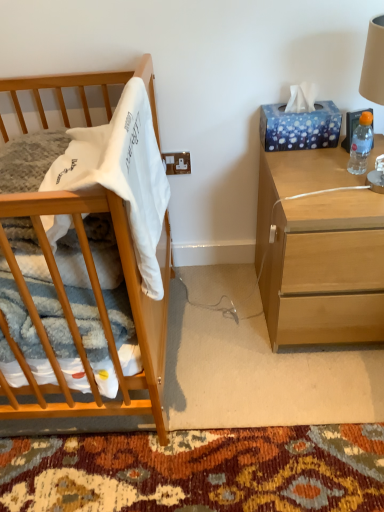
Question: Does clear plastic bottle at right come behind light wood nightstand at right?

Choices:
 (A) yes
 (B) no

Answer: (A)

Question: From a real-world perspective, is clear plastic bottle at right physically above light wood nightstand at right?

Choices:
 (A) no
 (B) yes

Answer: (B)

Question: Can you confirm if clear plastic bottle at right is smaller than light wood nightstand at right?

Choices:
 (A) no
 (B) yes

Answer: (B)

Question: Is clear plastic bottle at right shorter than light wood nightstand at right?

Choices:
 (A) no
 (B) yes

Answer: (B)

Question: From the image's perspective, would you say clear plastic bottle at right is shown under light wood nightstand at right?

Choices:
 (A) yes
 (B) no

Answer: (B)

Question: From the image's perspective, is blue glossy tissue box at upper right above or below light wood nightstand at right?

Choices:
 (A) above
 (B) below

Answer: (A)

Question: In terms of height, does blue glossy tissue box at upper right look taller or shorter compared to light wood nightstand at right?

Choices:
 (A) short
 (B) tall

Answer: (A)

Question: Is point (286, 131) closer or farther from the camera than point (329, 278)?

Choices:
 (A) farther
 (B) closer

Answer: (A)

Question: Is blue glossy tissue box at upper right inside or outside of light wood nightstand at right?

Choices:
 (A) inside
 (B) outside

Answer: (B)

Question: Choose the correct answer: Is white soft fabric at left inside light wood nightstand at right or outside it?

Choices:
 (A) outside
 (B) inside

Answer: (A)

Question: Based on their sizes in the image, would you say white soft fabric at left is bigger or smaller than light wood nightstand at right?

Choices:
 (A) big
 (B) small

Answer: (B)

Question: Considering their positions, is white soft fabric at left located in front of or behind light wood nightstand at right?

Choices:
 (A) behind
 (B) front

Answer: (B)

Question: Considering the positions of white soft fabric at left and light wood nightstand at right in the image, is white soft fabric at left wider or thinner than light wood nightstand at right?

Choices:
 (A) wide
 (B) thin

Answer: (B)

Question: Is point (304, 208) closer or farther from the camera than point (286, 133)?

Choices:
 (A) closer
 (B) farther

Answer: (A)

Question: In terms of width, does light wood nightstand at right look wider or thinner when compared to blue glossy tissue box at upper right?

Choices:
 (A) wide
 (B) thin

Answer: (A)